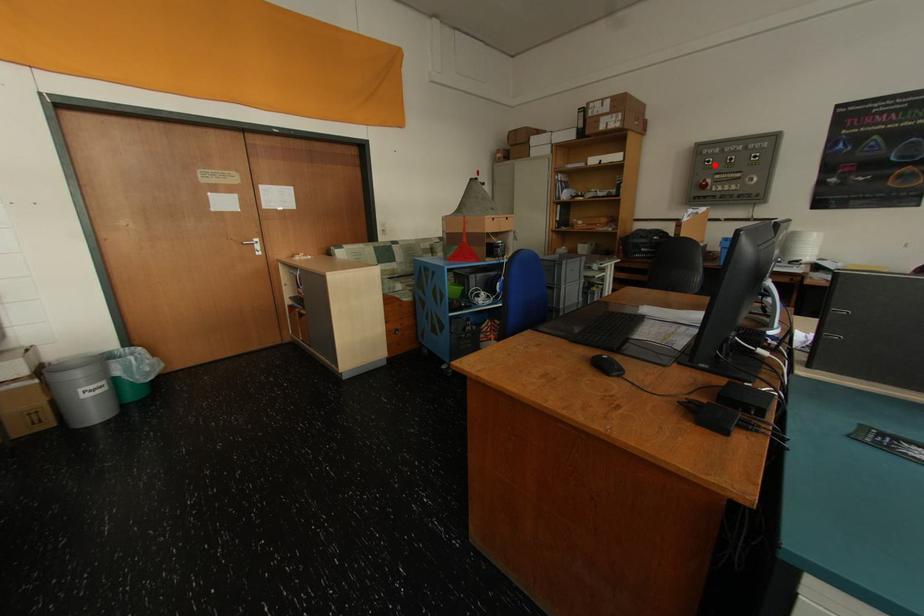
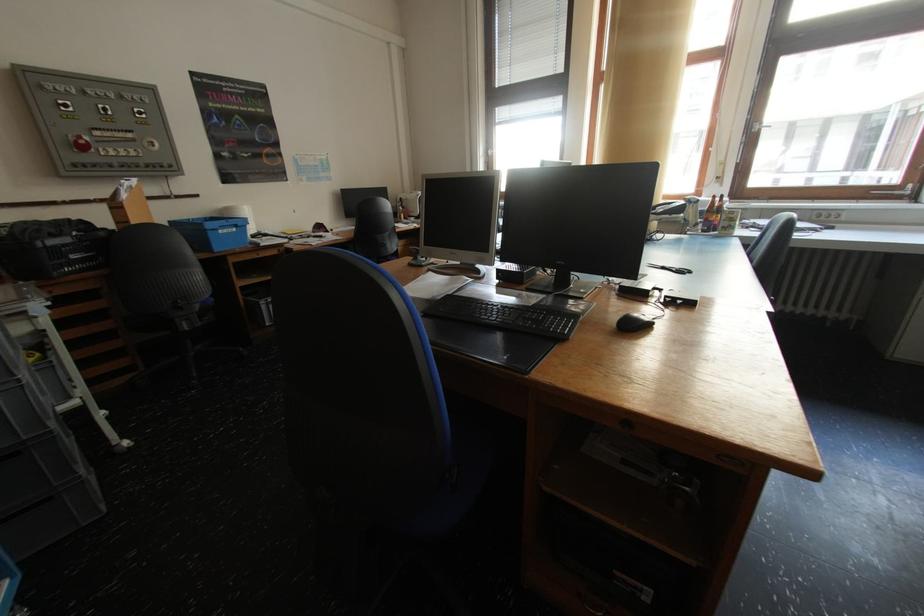
Question: I am providing you with two images of the same scene from different viewpoints. A red point is shown in image1. For the corresponding object point in image2, is it positioned nearer or farther from the camera?

Choices:
 (A) Nearer
 (B) Farther

Answer: (B)